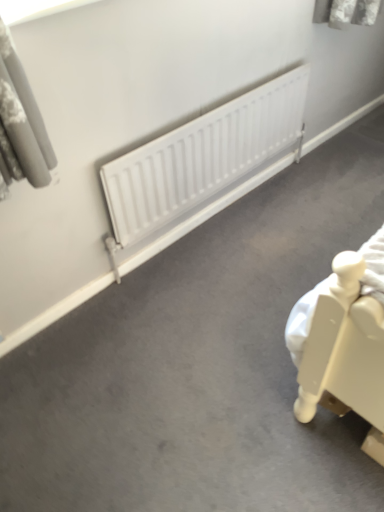
What is the approximate width of white matte radiator at center?

6.24 centimeters.

The width and height of the screenshot is (384, 512). Describe the element at coordinates (202, 156) in the screenshot. I see `white matte radiator at center` at that location.

In order to face white matte radiator at center, should I rotate leftwards or rightwards?

Rotate your view right by about 4.386°.

Locate an element on the screen. This screenshot has width=384, height=512. white matte radiator at center is located at coordinates (202, 156).

At what (x,y) coordinates should I click in order to perform the action: click on white matte radiator at center. Please return your answer as a coordinate pair (x, y). The height and width of the screenshot is (512, 384). Looking at the image, I should click on tap(202, 156).